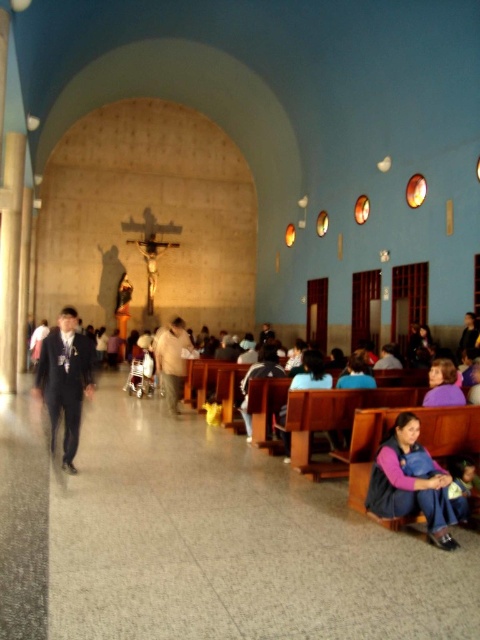
Is matte black suit at center thinner than purple fabric at lower right?

No, matte black suit at center is not thinner than purple fabric at lower right.

Does matte black suit at center have a greater width compared to purple fabric at lower right?

Yes, matte black suit at center is wider than purple fabric at lower right.

Image resolution: width=480 pixels, height=640 pixels. In order to click on matte black suit at center in this screenshot , I will do `click(64, 380)`.

Identify the location of matte black suit at center. Image resolution: width=480 pixels, height=640 pixels. (64, 380).

Is denim vest at lower right below light brown leather jacket at center?

Yes, denim vest at lower right is below light brown leather jacket at center.

Does denim vest at lower right appear on the left side of light brown leather jacket at center?

In fact, denim vest at lower right is to the right of light brown leather jacket at center.

Where is `denim vest at lower right`? The width and height of the screenshot is (480, 640). denim vest at lower right is located at coordinates (410, 483).

Can you confirm if denim vest at lower right is wider than purple fabric at lower right?

Yes.

Which is behind, point (389, 484) or point (441, 364)?

The point (441, 364) is more distant.

Who is more forward, (369, 490) or (465, 403)?

Point (369, 490)

Find the location of a particular element. This screenshot has height=640, width=480. denim vest at lower right is located at coordinates (410, 483).